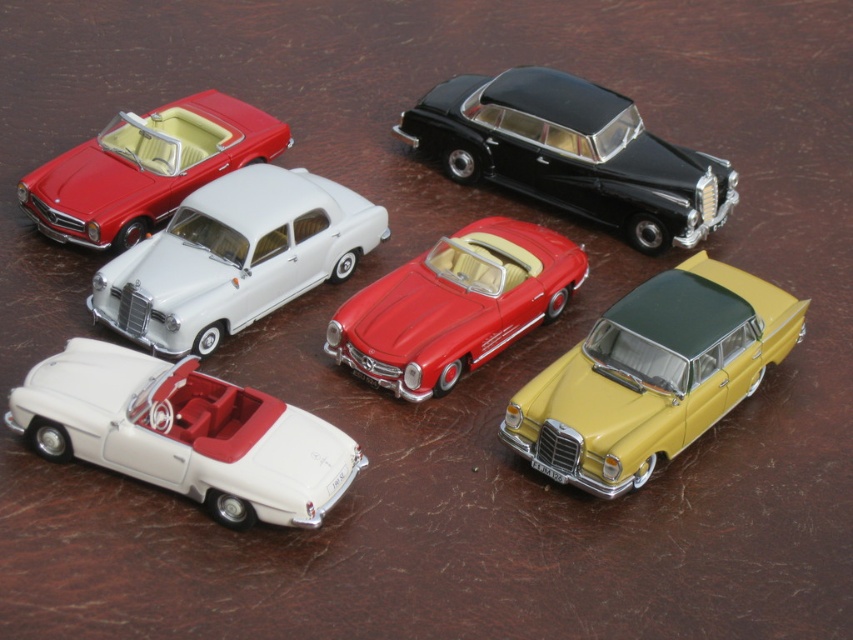
Question: Does white matte convertible at lower left appear over white glossy sedan at center?

Choices:
 (A) yes
 (B) no

Answer: (B)

Question: Is the position of white matte convertible at lower left more distant than that of matte white convertible at upper left?

Choices:
 (A) yes
 (B) no

Answer: (B)

Question: Estimate the real-world distances between objects in this image. Which object is farther from the black metallic sedan at upper right?

Choices:
 (A) white matte convertible at lower left
 (B) matte white convertible at upper left
 (C) shiny red convertible at center
 (D) yellow matte sedan at lower right

Answer: (A)

Question: Which point is closer to the camera?

Choices:
 (A) (38, 417)
 (B) (173, 316)
 (C) (674, 308)

Answer: (A)

Question: Estimate the real-world distances between objects in this image. Which object is farther from the white matte convertible at lower left?

Choices:
 (A) shiny red convertible at center
 (B) matte white convertible at upper left
 (C) white glossy sedan at center

Answer: (B)

Question: Is the position of black metallic sedan at upper right less distant than that of shiny red convertible at center?

Choices:
 (A) no
 (B) yes

Answer: (A)